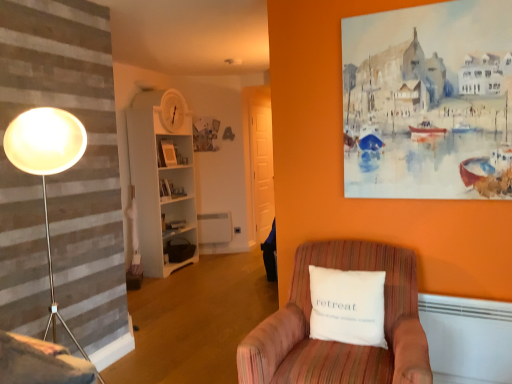
Question: Would you say striped fabric armchair at lower right is to the left or to the right of white wood bookshelf at center in the picture?

Choices:
 (A) right
 (B) left

Answer: (A)

Question: From their relative heights in the image, would you say striped fabric armchair at lower right is taller or shorter than white wood bookshelf at center?

Choices:
 (A) short
 (B) tall

Answer: (A)

Question: Which is nearer to the white wood bookshelf at center?

Choices:
 (A) striped fabric armchair at lower right
 (B) white soft cushion at center
 (C) velvet pink swivel chair at lower left

Answer: (A)

Question: Estimate the real-world distances between objects in this image. Which object is closer to the white wood bookshelf at center?

Choices:
 (A) white soft cushion at center
 (B) striped fabric armchair at lower right
 (C) velvet pink swivel chair at lower left

Answer: (B)